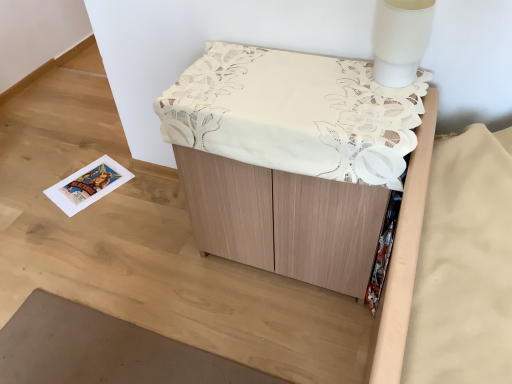
Question: From the image's perspective, is white matte table lamp at upper right positioned above or below wooden cabinet at center?

Choices:
 (A) below
 (B) above

Answer: (B)

Question: Is point (385, 34) closer or farther from the camera than point (323, 190)?

Choices:
 (A) closer
 (B) farther

Answer: (A)

Question: From a real-world perspective, is white matte table lamp at upper right above or below wooden cabinet at center?

Choices:
 (A) above
 (B) below

Answer: (A)

Question: Considering the relative positions of wooden cabinet at center and white matte table lamp at upper right in the image provided, is wooden cabinet at center to the left or to the right of white matte table lamp at upper right?

Choices:
 (A) left
 (B) right

Answer: (A)

Question: Looking at the image, does wooden cabinet at center seem bigger or smaller compared to white matte table lamp at upper right?

Choices:
 (A) small
 (B) big

Answer: (B)

Question: Considering the positions of wooden cabinet at center and white matte table lamp at upper right in the image, is wooden cabinet at center wider or thinner than white matte table lamp at upper right?

Choices:
 (A) thin
 (B) wide

Answer: (B)

Question: Is wooden cabinet at center in front of or behind white matte table lamp at upper right in the image?

Choices:
 (A) front
 (B) behind

Answer: (A)